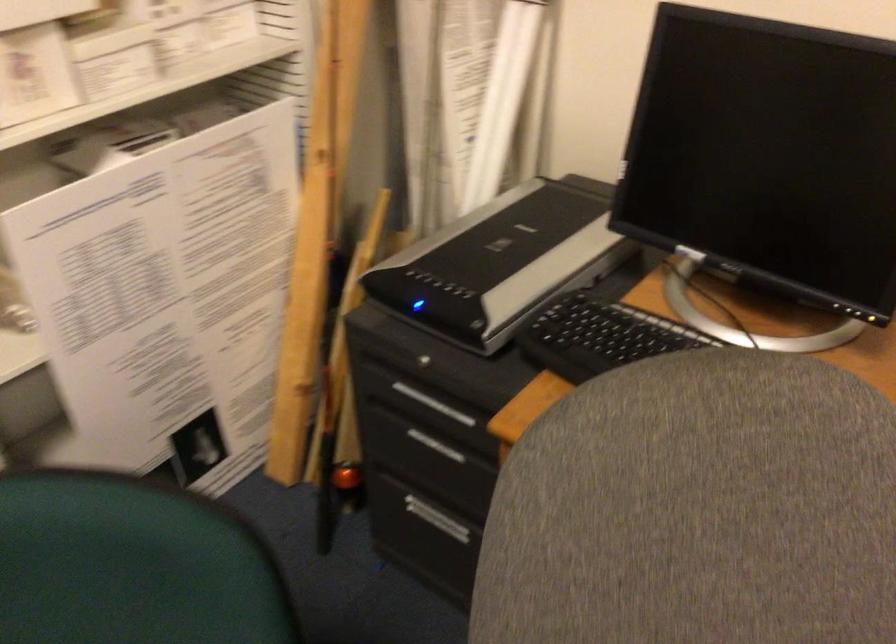
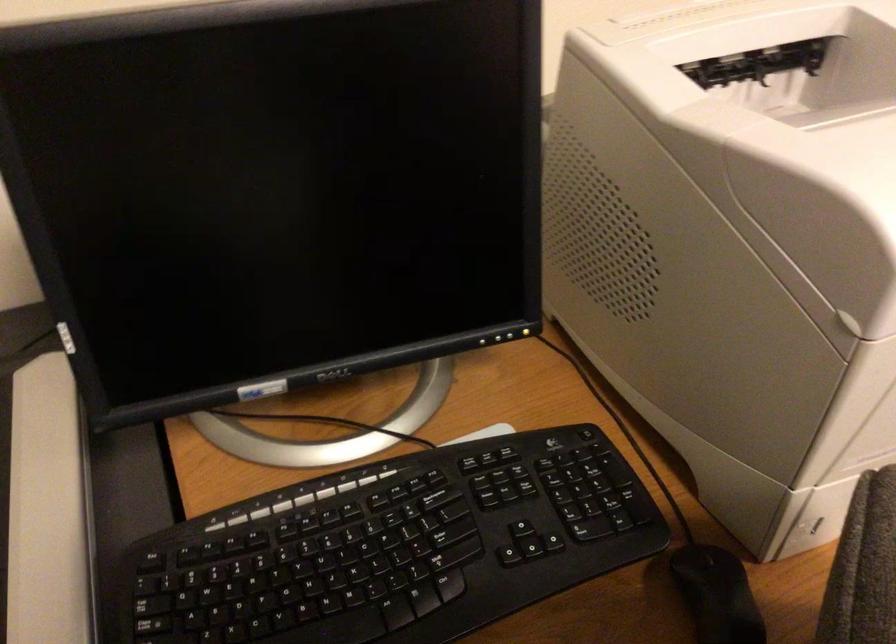
Find the pixel in the second image that matches point 607,330 in the first image.

(250, 583)